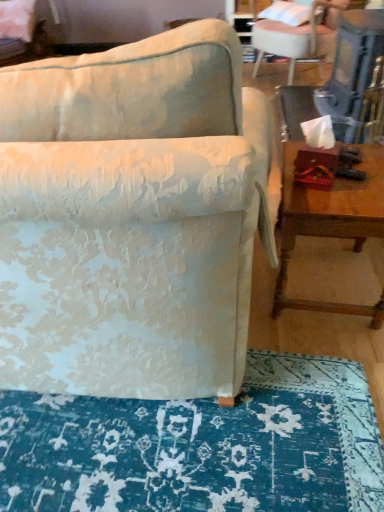
Identify the location of vacant area situated below wooden table at right (from a real-world perspective). (317, 271).